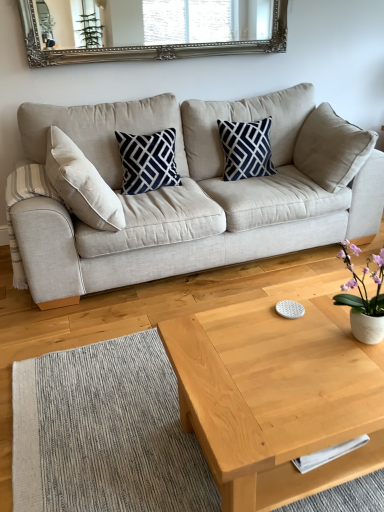
At what (x,y) coordinates should I click in order to perform the action: click on free space above light wood/texture coffee table at center (from a real-world perspective). Please return your answer as a coordinate pair (x, y). This screenshot has height=512, width=384. Looking at the image, I should click on (292, 350).